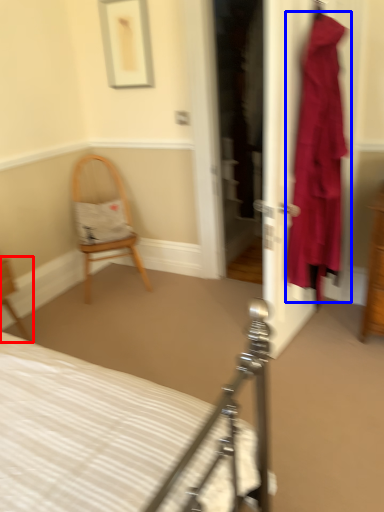
Question: Which of the following is the closest to the observer, chair (highlighted by a red box) or clothing (highlighted by a blue box)?

Choices:
 (A) chair
 (B) clothing

Answer: (B)